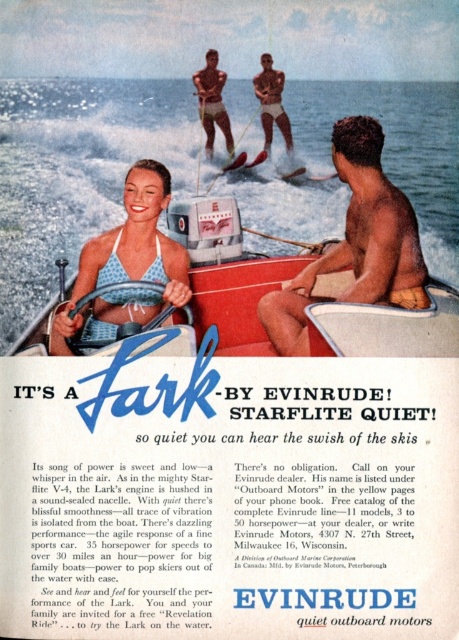
Question: Does matte blue steering wheel at center have a larger size compared to smooth skin man at center?

Choices:
 (A) no
 (B) yes

Answer: (B)

Question: Among these points, which one is farthest from the camera?

Choices:
 (A) (54, 330)
 (B) (408, 248)

Answer: (A)

Question: Can you confirm if matte blue steering wheel at center is positioned to the left of blue polka dot bikini at center?

Choices:
 (A) no
 (B) yes

Answer: (A)

Question: Among these points, which one is farthest from the camera?

Choices:
 (A) (447, 340)
 (B) (262, 109)
 (C) (364, 260)

Answer: (B)

Question: Which of the following is the closest to the observer?

Choices:
 (A) (306, 337)
 (B) (100, 250)

Answer: (A)

Question: Does blue polka dot bikini at center lie behind smooth skin man at center?

Choices:
 (A) no
 (B) yes

Answer: (A)